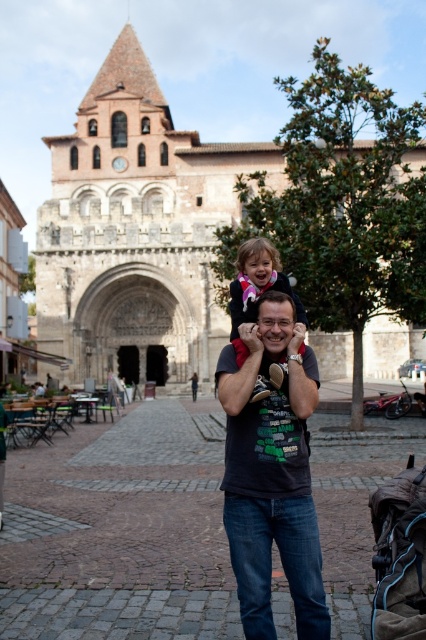
Describe the element at coordinates (135, 230) in the screenshot. I see `brown stone church at center` at that location.

Between brown stone church at center and matte pink sweater at center, which one appears on the left side from the viewer's perspective?

brown stone church at center is more to the left.

Find the location of a particular element. brown stone church at center is located at coordinates (135, 230).

Can you confirm if dark gray t-shirt at center is bigger than matte pink sweater at center?

Yes.

Does point (284, 477) lie behind point (261, 259)?

No, it is not.

Is point (299, 593) positioned behind point (261, 256)?

That is False.

Locate an element on the screen. The height and width of the screenshot is (640, 426). dark gray t-shirt at center is located at coordinates (271, 474).

Who is positioned more to the right, smooth stone pavement at center or brown stone church at center?

From the viewer's perspective, brown stone church at center appears more on the right side.

Which is more to the left, smooth stone pavement at center or brown stone church at center?

Positioned to the left is smooth stone pavement at center.

Is point (103, 536) in front of point (196, 250)?

Yes, point (103, 536) is closer to viewer.

Image resolution: width=426 pixels, height=640 pixels. I want to click on smooth stone pavement at center, so click(x=118, y=532).